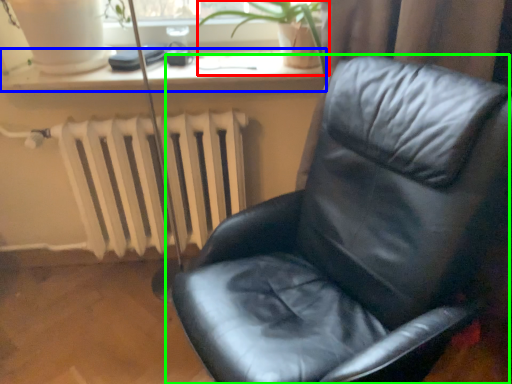
Question: Which is farther away from plant (highlighted by a red box)? window sill (highlighted by a blue box) or chair (highlighted by a green box)?

Choices:
 (A) window sill
 (B) chair

Answer: (B)